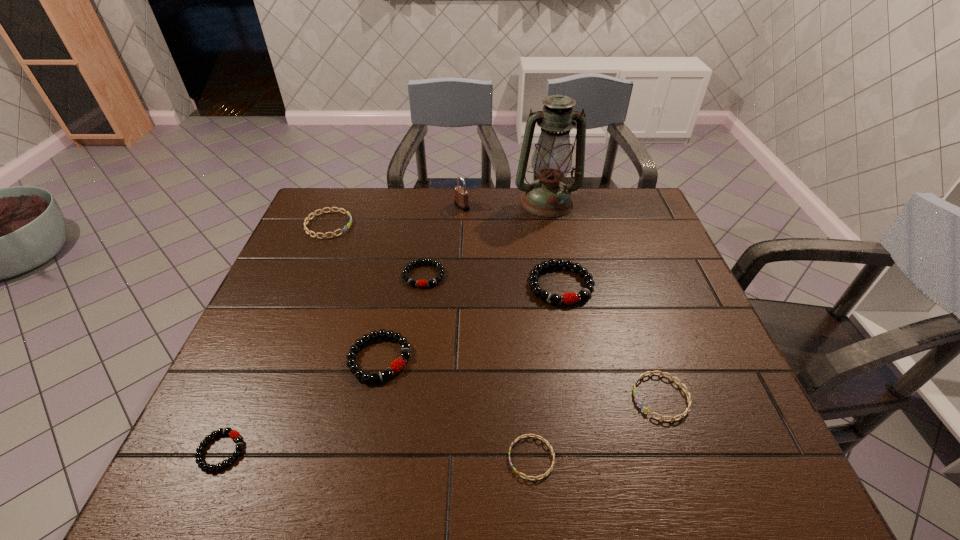
Find the location of a particular element. The height and width of the screenshot is (540, 960). free space that satisfies the following two spatial constraints: 1. on the back side of the third biggest black bracelet; 2. on the right side of the padlock is located at coordinates (433, 206).

The width and height of the screenshot is (960, 540). Identify the location of free space that satisfies the following two spatial constraints: 1. on the back side of the smallest black bracelet; 2. on the right side of the tallest bracelet. (295, 285).

Locate an element on the screen. free space that satisfies the following two spatial constraints: 1. on the surface of the biggest blue bracelet showing star-shaped elements; 2. on the left side of the second biggest black bracelet is located at coordinates (273, 358).

Where is `blank area in the image that satisfies the following two spatial constraints: 1. on the back side of the rightmost black bracelet; 2. on the surface of the farthest blue bracelet showing star-shaped elements`? blank area in the image that satisfies the following two spatial constraints: 1. on the back side of the rightmost black bracelet; 2. on the surface of the farthest blue bracelet showing star-shaped elements is located at coordinates (549, 225).